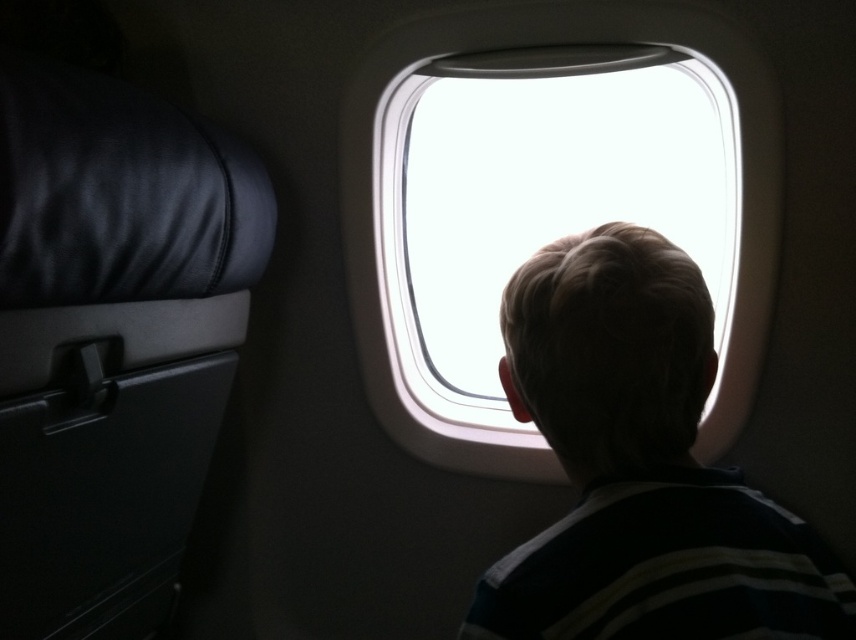
Question: Does blonde hair at window right appear over transparent glass airplane window at center?

Choices:
 (A) yes
 (B) no

Answer: (B)

Question: Does blonde hair at window right appear under transparent glass airplane window at center?

Choices:
 (A) no
 (B) yes

Answer: (B)

Question: Can you confirm if blonde hair at window right is positioned above transparent glass airplane window at center?

Choices:
 (A) no
 (B) yes

Answer: (A)

Question: Which point is closer to the camera taking this photo?

Choices:
 (A) (425, 83)
 (B) (649, 304)

Answer: (B)

Question: Which object is closer to the camera taking this photo?

Choices:
 (A) blonde hair at window right
 (B) transparent glass airplane window at center

Answer: (A)